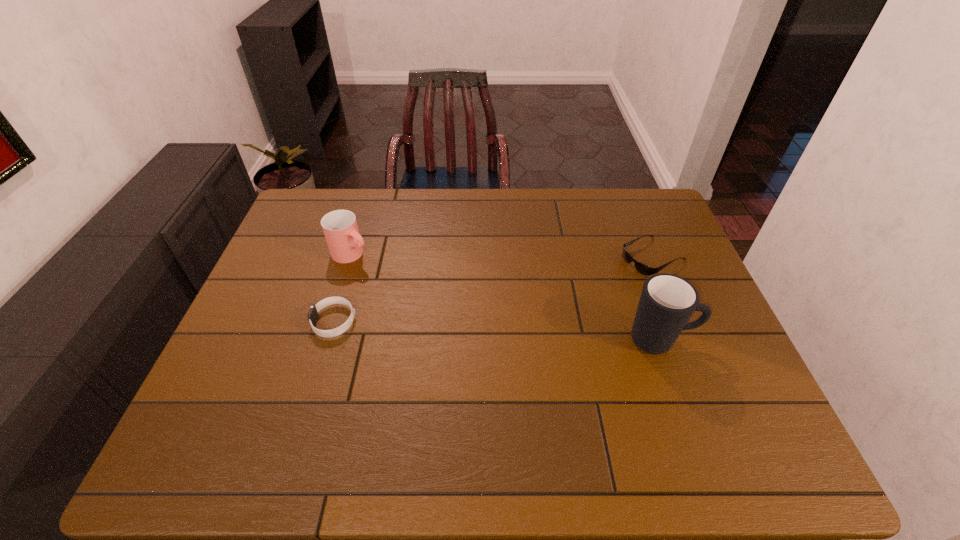
Where is `wristband`? The image size is (960, 540). wristband is located at coordinates (312, 316).

The image size is (960, 540). What are the coordinates of `mug` in the screenshot? It's located at (667, 302).

The image size is (960, 540). Identify the location of the third shortest object. (340, 228).

Identify the location of sunglasses. The width and height of the screenshot is (960, 540). (646, 270).

Locate an element on the screen. free region located on the outer surface of the wristband is located at coordinates (287, 321).

You are a GUI agent. You are given a task and a screenshot of the screen. Output one action in this format:
    pyautogui.click(x=<x>, y=<y>)
    Task: Click on the vacant space positioned 0.060m on the outer surface of the wristband
    This screenshot has height=540, width=960.
    Given the screenshot: What is the action you would take?
    pyautogui.click(x=290, y=321)

Where is `vacant space located 0.050m on the side of the mug with the handle`? The height and width of the screenshot is (540, 960). vacant space located 0.050m on the side of the mug with the handle is located at coordinates (716, 340).

Find the location of `vacant space located on the side of the second tallest object with the handle`. vacant space located on the side of the second tallest object with the handle is located at coordinates (435, 303).

What are the coordinates of `vacant area situated 0.290m on the side of the second tallest object with the handle` in the screenshot? It's located at (438, 305).

Where is `free space located on the side of the second tallest object with the handle`? The height and width of the screenshot is (540, 960). free space located on the side of the second tallest object with the handle is located at coordinates (444, 308).